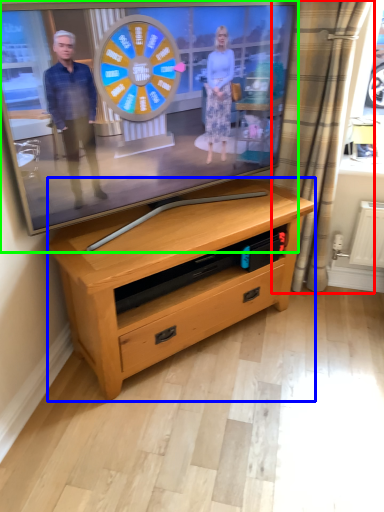
Question: Based on their relative distances, which object is nearer to curtain (highlighted by a red box)? Choose from chest of drawers (highlighted by a blue box) and television (highlighted by a green box).

Choices:
 (A) chest of drawers
 (B) television

Answer: (B)